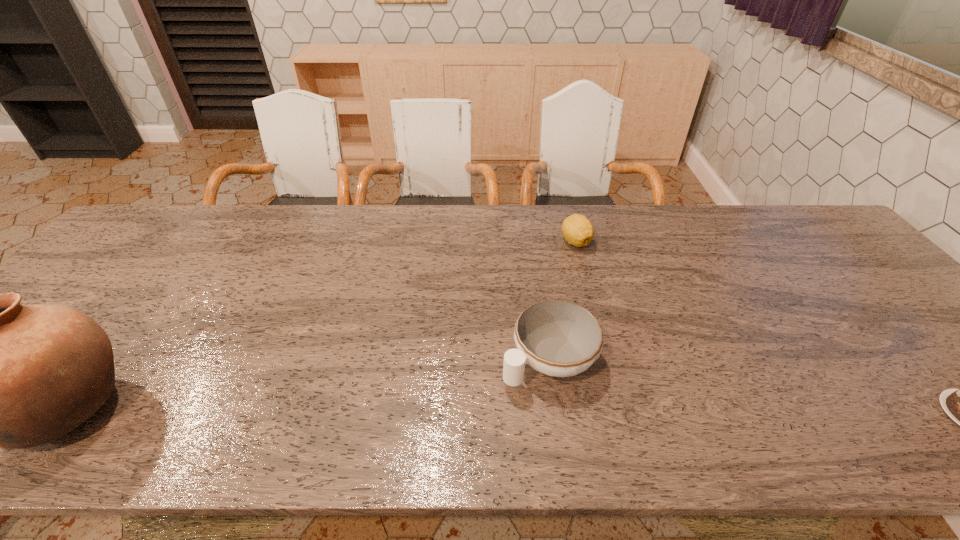
Where is `the second tallest object`? The image size is (960, 540). the second tallest object is located at coordinates (558, 338).

Locate an element on the screen. Image resolution: width=960 pixels, height=540 pixels. the farthest object is located at coordinates (577, 229).

Find the location of a particular element. This screenshot has height=540, width=960. the third tallest object is located at coordinates (577, 229).

This screenshot has width=960, height=540. I want to click on free space located 0.100m on the side with the handle of the chinaware, so click(x=474, y=404).

This screenshot has width=960, height=540. I want to click on free spot located at the stem end of the farthest object, so click(x=584, y=297).

Find the location of a particular element. Image resolution: width=960 pixels, height=540 pixels. free space located 0.200m at the stem end of the farthest object is located at coordinates (585, 302).

The image size is (960, 540). Identify the location of free region located at the stem end of the farthest object. (590, 344).

What are the coordinates of `object at the far edge` in the screenshot? It's located at (577, 229).

The height and width of the screenshot is (540, 960). I want to click on object situated at the near edge, so click(x=558, y=338).

Where is `free space at the far edge of the desktop`? The image size is (960, 540). free space at the far edge of the desktop is located at coordinates (558, 219).